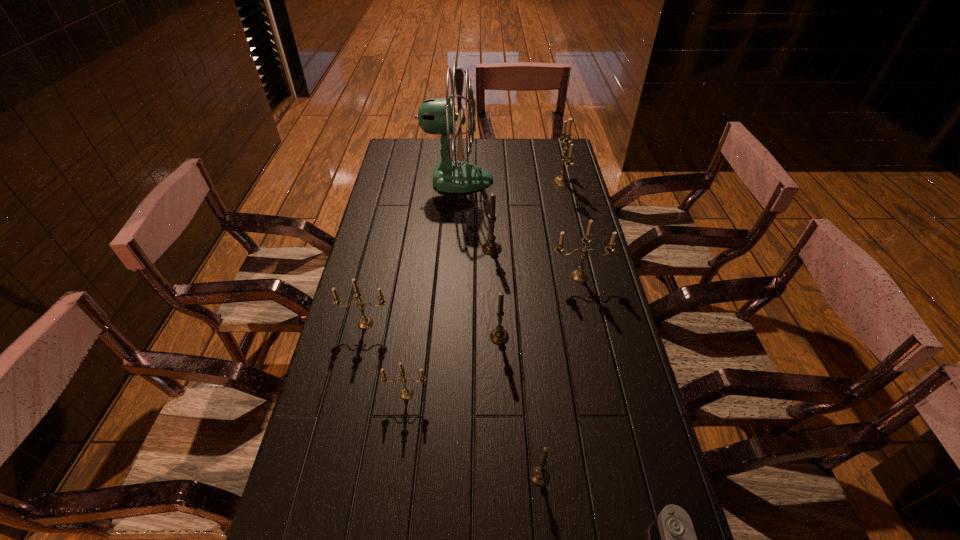
In order to click on vacant position located on the front of the leftmost object in this screenshot , I will do `click(344, 417)`.

Find the location of a particular element. The height and width of the screenshot is (540, 960). vacant position located on the back of the fifth candle from left to right is located at coordinates (534, 409).

At what (x,y) coordinates should I click in order to perform the action: click on free space located on the back of the smallest metallic candle. Please return your answer as a coordinate pair (x, y). Looking at the image, I should click on (410, 372).

Where is `object that is at the far edge`? This screenshot has width=960, height=540. object that is at the far edge is located at coordinates (436, 116).

Identify the location of fan at the left edge. Image resolution: width=960 pixels, height=540 pixels. point(436,116).

Identify the location of object present at the far left corner. This screenshot has width=960, height=540. (436, 116).

At what (x,y) coordinates should I click in order to perform the action: click on vacant space at the far edge of the desktop. Please return your answer as a coordinate pair (x, y). This screenshot has width=960, height=540. Looking at the image, I should click on (507, 148).

Locate an element on the screen. vacant space at the left edge of the desktop is located at coordinates click(285, 518).

Find the location of a particular element. Image resolution: width=960 pixels, height=540 pixels. vacant region at the right edge is located at coordinates (587, 390).

I want to click on free space at the far left corner of the desktop, so click(x=392, y=159).